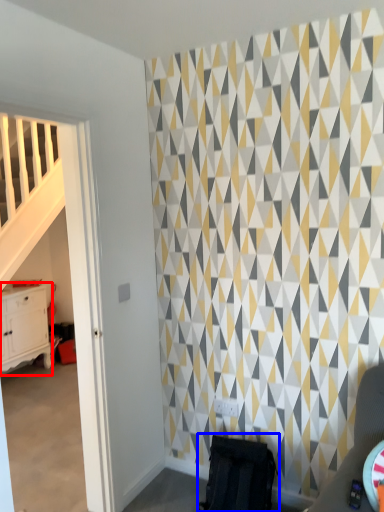
Question: Which object is further to the camera taking this photo, chest of drawers (highlighted by a red box) or swivel chair (highlighted by a blue box)?

Choices:
 (A) chest of drawers
 (B) swivel chair

Answer: (A)